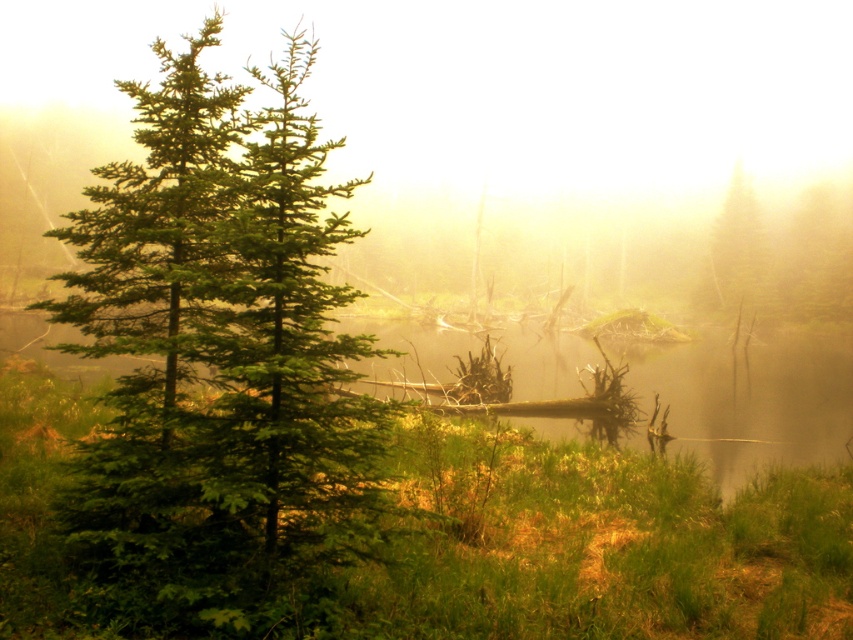
You are a hiker who wants to cross the forest to reach a cabin located beyond the green matte tree at upper right. You are currently standing next to the green matte tree at left. Considering the distance between them, can you safely walk directly between these two trees without encountering any obstacles?

The distance between the green matte tree at left and the green matte tree at upper right is 30.41 meters. Since there is no mention of obstacles in the scene description, you can safely walk directly between them.

You are a hiker who wants to cross the pond without getting your boots wet. You see the green matte tree at left and the green matte tree at right. Which tree is closer to the pond?

The green matte tree at left is closer to the pond than the green matte tree at right because they are 5.26 meters apart.